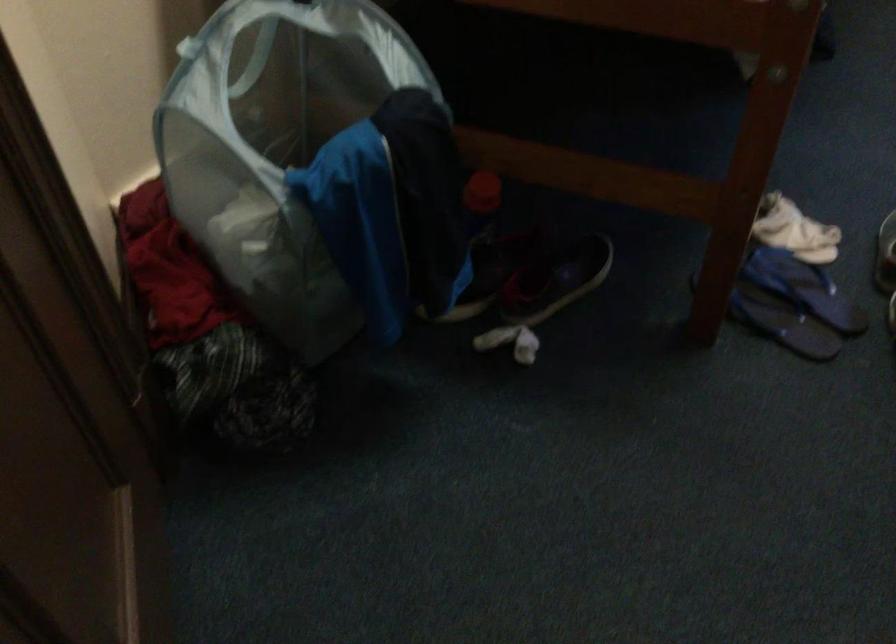
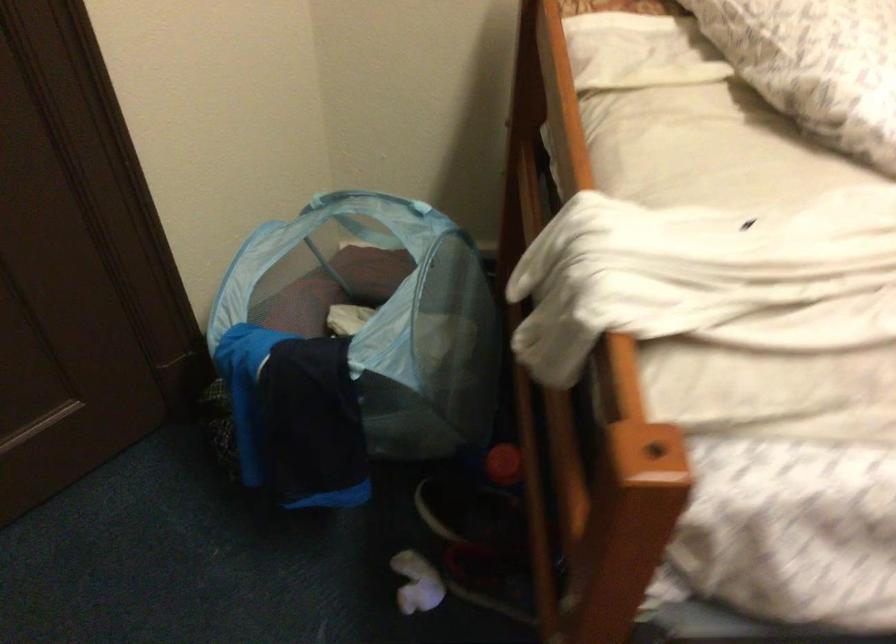
In the second image, find the point that corresponds to [515,328] in the first image.

(417, 583)